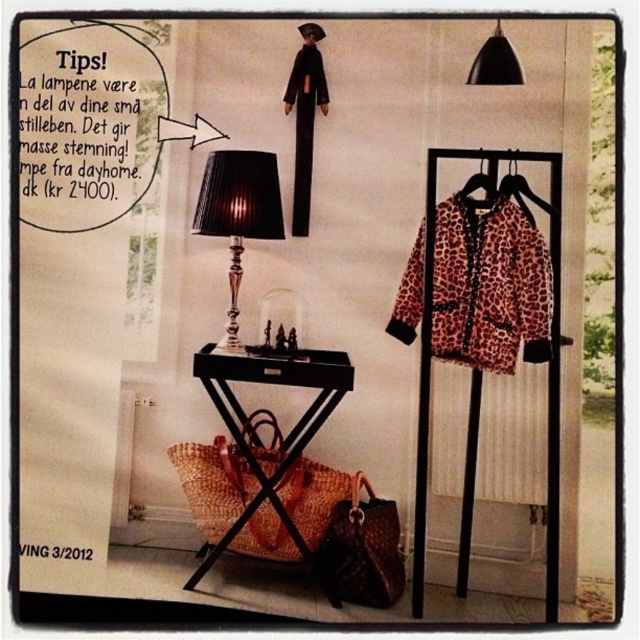
You are a fashion designer who wants to hang a leopard print fabric jacket at right and a leopard print fabric hanger at upper right on a wall. The wall has a maximum width of 10 inches. Can both items fit side by side without overlapping?

The leopard print fabric jacket at right and leopard print fabric hanger at upper right are 8.56 inches apart. Since the wall is 10 inches wide, both items can fit side by side without overlapping as the total required space is less than the wall width.

You are standing at the entrance of a room and see the black triangular side table with metallic base and dark wooden top and the woven wood stool at lower center. Which object is closer to you?

The black triangular side table with metallic base and dark wooden top is closer to you since they are 7.04 feet apart, and the stool is at lower center, implying it is further away.